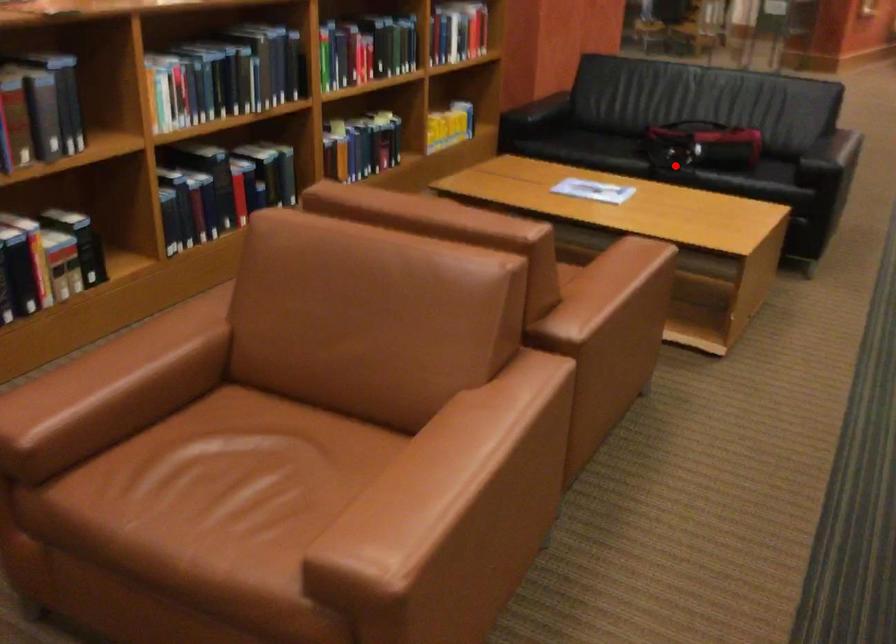
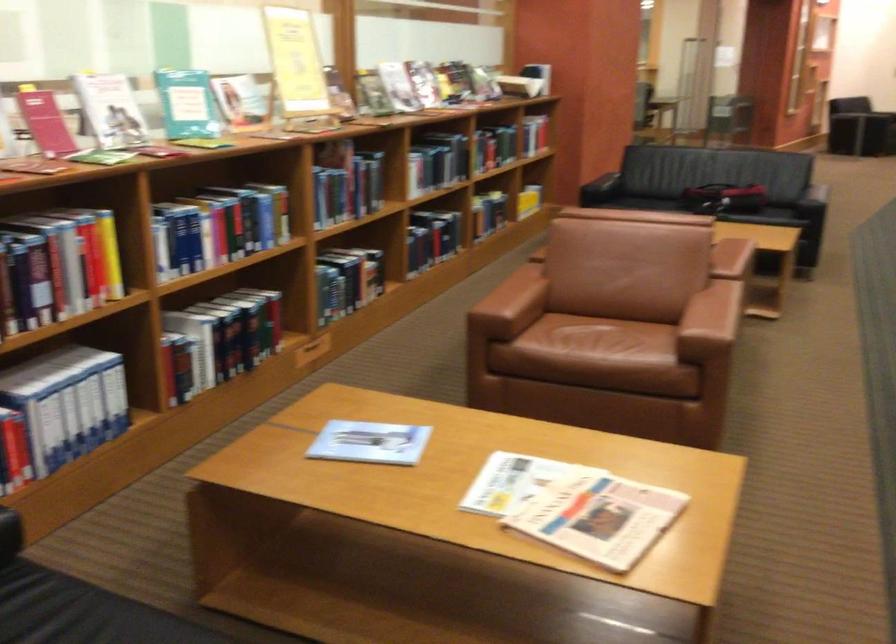
The point at the highlighted location is marked in the first image. Where is the corresponding point in the second image?

(725, 198)